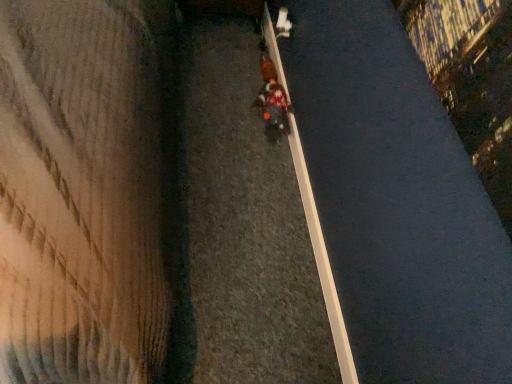
Question: In the image, is white smooth curb at center on the left side or the right side of knitted sweater at center?

Choices:
 (A) right
 (B) left

Answer: (A)

Question: Which is correct: white smooth curb at center is inside knitted sweater at center, or outside of it?

Choices:
 (A) inside
 (B) outside

Answer: (B)

Question: Which of these objects is positioned farthest from the red fabric pedestrian at center?

Choices:
 (A) knitted sweater at center
 (B) white smooth curb at center

Answer: (B)

Question: Which object is positioned closest to the red fabric pedestrian at center?

Choices:
 (A) white smooth curb at center
 (B) knitted sweater at center

Answer: (B)